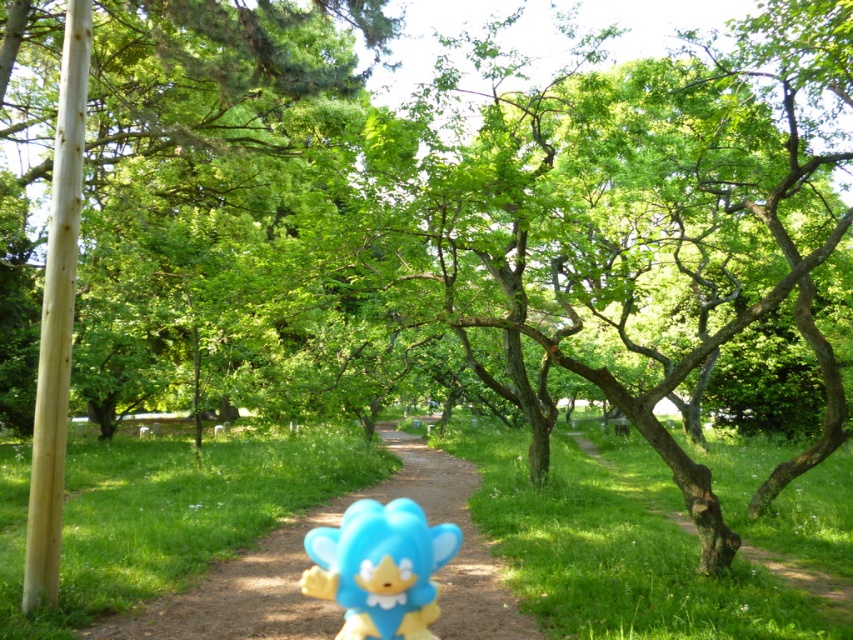
Who is taller, green leafy tree at center or blue plastic toy at center?

green leafy tree at center

Between green leafy tree at center and blue plastic toy at center, which one is positioned higher?

green leafy tree at center is above.

Is point (160, 104) positioned behind point (398, 436)?

No.

Locate an element on the screen. green leafy tree at center is located at coordinates (192, 148).

Is green grassy trail at center taller than blue rubber toy at center?

Indeed, green grassy trail at center has a greater height compared to blue rubber toy at center.

Is green grassy trail at center smaller than blue rubber toy at center?

Incorrect, green grassy trail at center is not smaller in size than blue rubber toy at center.

Identify the location of green grassy trail at center. The height and width of the screenshot is (640, 853). (738, 532).

In the scene shown: Is green leafy tree at center to the right of green grassy trail at center from the viewer's perspective?

In fact, green leafy tree at center is to the left of green grassy trail at center.

Is green leafy tree at center below green grassy trail at center?

Actually, green leafy tree at center is above green grassy trail at center.

Locate an element on the screen. green leafy tree at center is located at coordinates (192, 148).